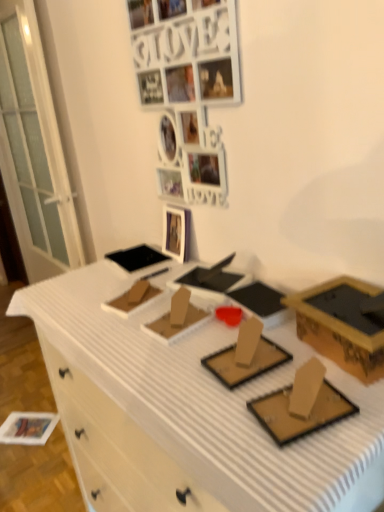
You are a GUI agent. You are given a task and a screenshot of the screen. Output one action in this format:
    pyautogui.click(x=<x>, y=<y>)
    Task: Click on the vacant area in front of white glossy picture frame at upper center
    The image size is (384, 512).
    Given the screenshot: What is the action you would take?
    pyautogui.click(x=172, y=270)